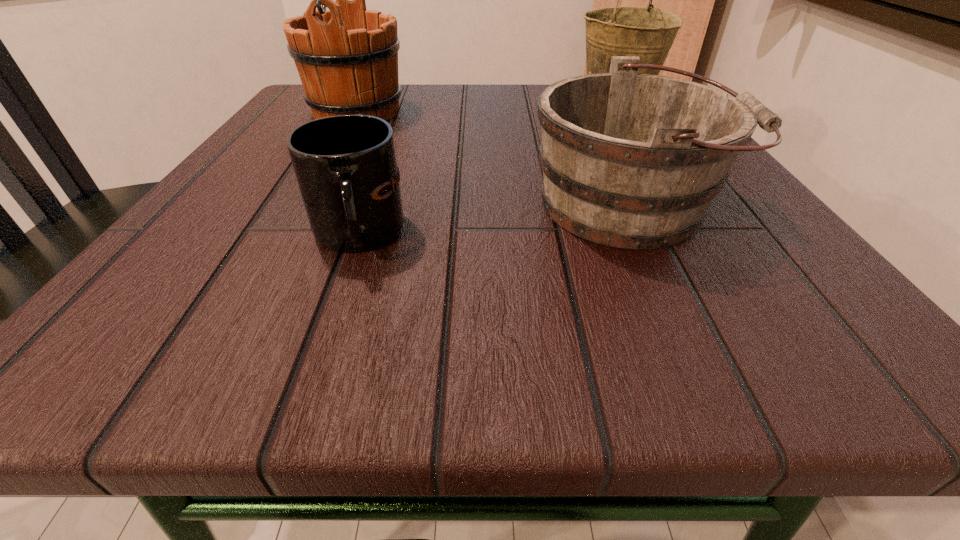
Where is `object situated at the left edge`? object situated at the left edge is located at coordinates (347, 57).

The image size is (960, 540). In order to click on object that is positioned at the far left corner in this screenshot , I will do `click(347, 57)`.

You are a GUI agent. You are given a task and a screenshot of the screen. Output one action in this format:
    pyautogui.click(x=<x>, y=<y>)
    Task: Click on the object at the far right corner
    
    Given the screenshot: What is the action you would take?
    pyautogui.click(x=646, y=32)

What are the coordinates of `vacant region at the far edge` in the screenshot? It's located at click(445, 112).

Image resolution: width=960 pixels, height=540 pixels. In order to click on vacant space at the near edge of the desktop in this screenshot , I will do `click(302, 318)`.

Locate an element on the screen. free space at the left edge is located at coordinates (237, 265).

At what (x,y) coordinates should I click in order to perform the action: click on free space at the near left corner. Please return your answer as a coordinate pair (x, y). Image resolution: width=960 pixels, height=540 pixels. Looking at the image, I should click on (180, 315).

In order to click on vacant point located between the mug and the nearest wine bucket in this screenshot , I will do `click(492, 220)`.

Where is `free space between the shortest object and the third tallest object`? The width and height of the screenshot is (960, 540). free space between the shortest object and the third tallest object is located at coordinates (492, 220).

This screenshot has height=540, width=960. In order to click on vacant point located between the nearest wine bucket and the shortest object in this screenshot , I will do `click(492, 220)`.